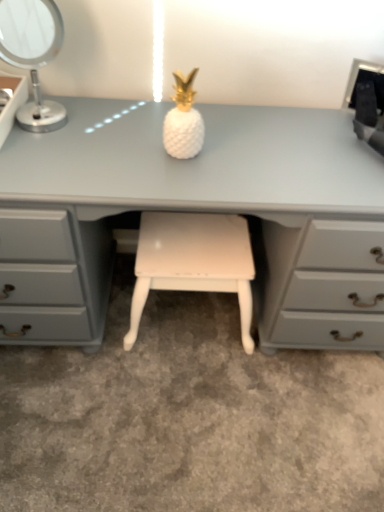
Where is `blank space above matte white desk at center (from a real-world perspective)`? This screenshot has height=512, width=384. blank space above matte white desk at center (from a real-world perspective) is located at coordinates (176, 154).